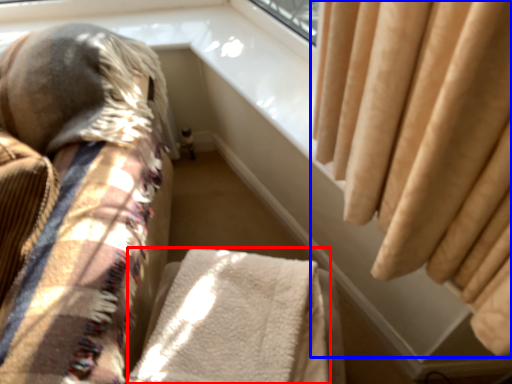
Question: Among these objects, which one is nearest to the camera, blanket (highlighted by a red box) or curtain (highlighted by a blue box)?

Choices:
 (A) blanket
 (B) curtain

Answer: (A)